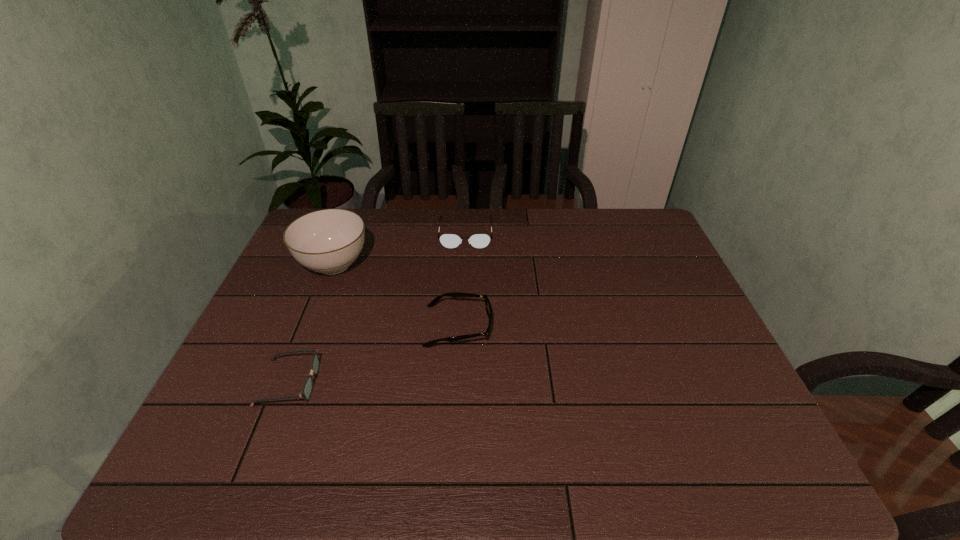
This screenshot has height=540, width=960. In order to click on spectacles situated at the far edge in this screenshot , I will do `click(479, 241)`.

I want to click on chinaware at the left edge, so click(x=327, y=241).

Locate an element on the screen. spectacles present at the left edge is located at coordinates (307, 389).

Image resolution: width=960 pixels, height=540 pixels. I want to click on object positioned at the far left corner, so click(327, 241).

In the image, there is a desktop. Identify the location of vacant space at the far edge. (516, 217).

I want to click on vacant space at the near edge of the desktop, so click(x=353, y=447).

Find the location of a particular element. Image resolution: width=960 pixels, height=540 pixels. free space at the left edge of the desktop is located at coordinates (218, 400).

This screenshot has width=960, height=540. What are the coordinates of `free space at the right edge` in the screenshot? It's located at (660, 255).

Image resolution: width=960 pixels, height=540 pixels. I want to click on vacant space at the near left corner, so click(224, 468).

The image size is (960, 540). Find the location of `vacant area at the far right corner`. vacant area at the far right corner is located at coordinates (631, 231).